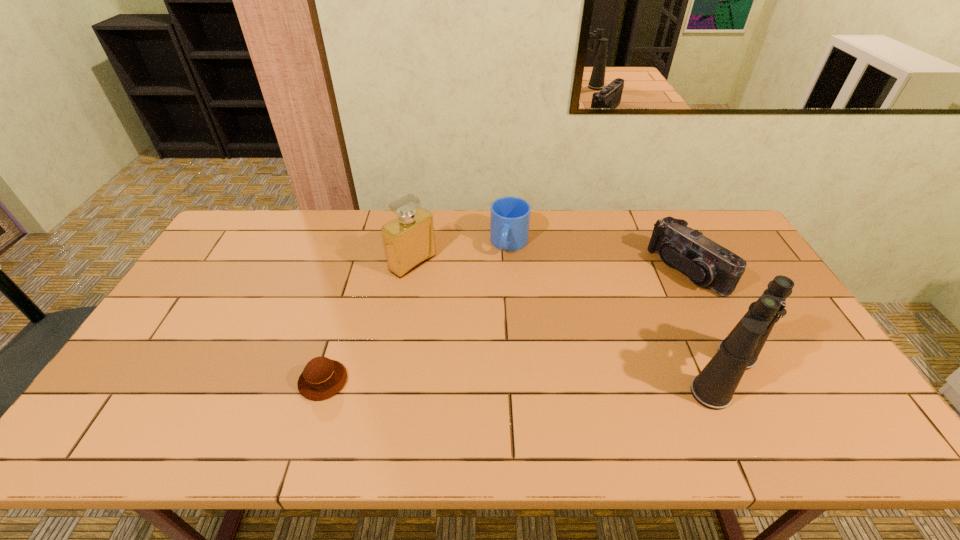
Identify the location of vacant area situated 0.300m on the front-facing side of the perfume. (500, 323).

The height and width of the screenshot is (540, 960). I want to click on free region located on the front-facing side of the perfume, so click(469, 302).

Find the location of a particular element. Image resolution: width=960 pixels, height=540 pixels. vacant area located on the front-facing side of the camcorder is located at coordinates (567, 341).

Find the location of a particular element. The height and width of the screenshot is (540, 960). free space located on the front-facing side of the camcorder is located at coordinates (643, 299).

Find the location of a particular element. This screenshot has height=540, width=960. blank space located on the front-facing side of the camcorder is located at coordinates (610, 318).

Locate an element on the screen. The height and width of the screenshot is (540, 960). blank space located on the side of the third object from right to left with the handle is located at coordinates (486, 334).

Locate an element on the screen. free space located 0.130m on the side of the third object from right to left with the handle is located at coordinates (498, 287).

Where is `vacant space located 0.060m on the side of the third object from right to left with the handle`? vacant space located 0.060m on the side of the third object from right to left with the handle is located at coordinates (503, 273).

Where is `perfume present at the far edge`? Image resolution: width=960 pixels, height=540 pixels. perfume present at the far edge is located at coordinates (409, 241).

In order to click on camcorder that is at the far edge in this screenshot , I will do `click(706, 263)`.